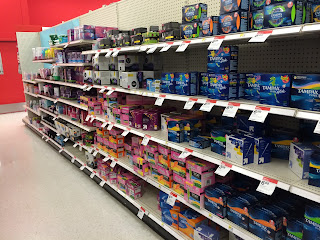
At what (x,y) coordinates should I click in order to perform the action: click on beige wall with larger black holes inside. Please return your answer as a coordinate pair (x, y). Looking at the image, I should click on (142, 12).